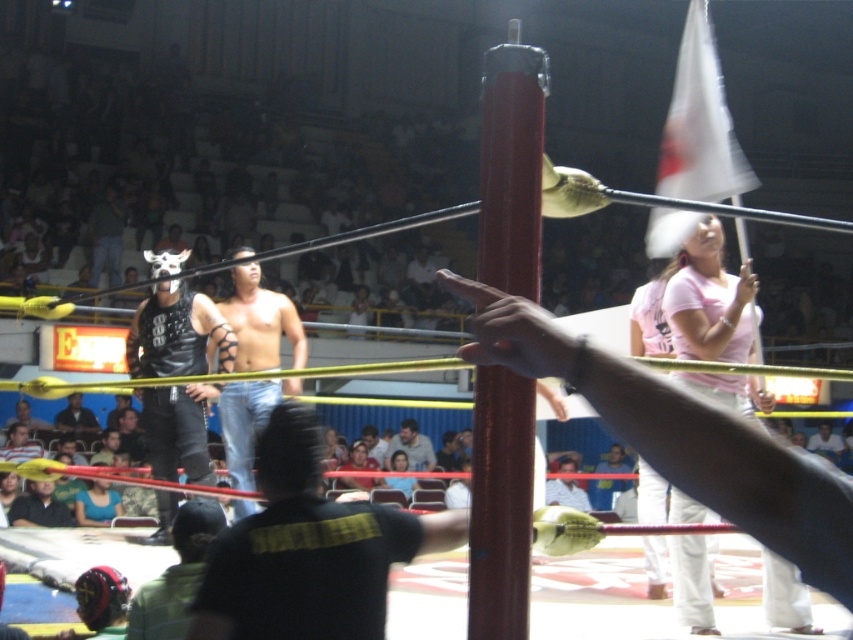
Does point (520, 410) come farther from viewer compared to point (410, 442)?

No, it is not.

Is shiny red pole at center closer to camera compared to beige fabric shirt at center?

That is True.

Which is behind, point (486, 212) or point (415, 428)?

The point (415, 428) is behind.

Locate an element on the screen. The height and width of the screenshot is (640, 853). shiny red pole at center is located at coordinates (500, 506).

Which of these two, beige fabric shirt at center or dark blue shirt at lower left, stands shorter?

Standing shorter between the two is dark blue shirt at lower left.

Does point (392, 444) lie in front of point (93, 419)?

No, (392, 444) is further to viewer.

Is point (405, 426) closer to viewer compared to point (68, 401)?

No, (405, 426) is further to viewer.

Locate an element on the screen. The width and height of the screenshot is (853, 640). beige fabric shirt at center is located at coordinates (413, 445).

What do you see at coordinates (177, 333) in the screenshot?
I see `black leather mask at left` at bounding box center [177, 333].

Which is more to the right, black leather mask at left or dark blue shirt at lower left?

From the viewer's perspective, black leather mask at left appears more on the right side.

Does point (234, 348) come in front of point (70, 417)?

That is True.

What are the coordinates of `black leather mask at left` in the screenshot? It's located at (177, 333).